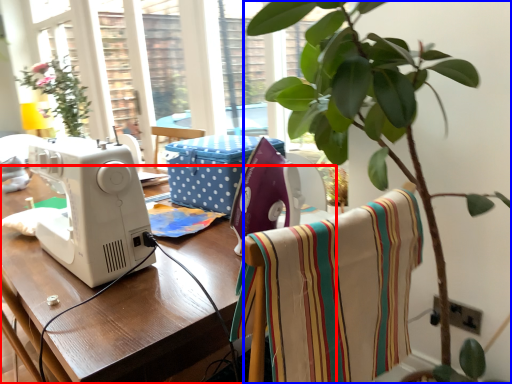
Question: Among these objects, which one is nearest to the camera, table (highlighted by a red box) or houseplant (highlighted by a blue box)?

Choices:
 (A) table
 (B) houseplant

Answer: (B)